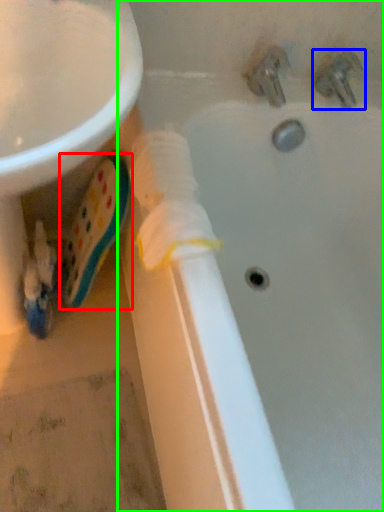
Question: Estimate the real-world distances between objects in this image. Which object is farther from toothpaste (highlighted by a red box), tap (highlighted by a blue box) or bathtub (highlighted by a green box)?

Choices:
 (A) tap
 (B) bathtub

Answer: (A)